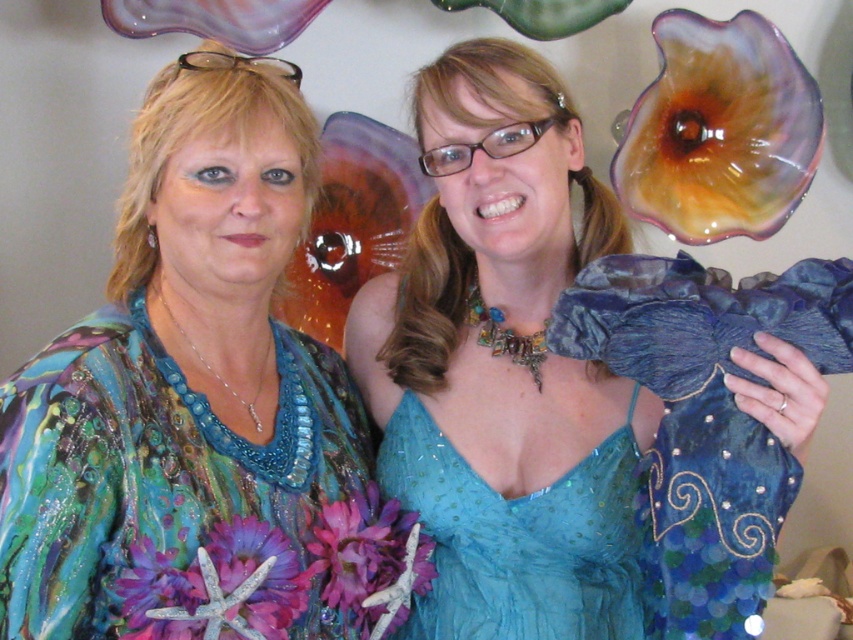
Question: Does blue sequined dress at center have a smaller size compared to teal sheer dress at center?

Choices:
 (A) no
 (B) yes

Answer: (A)

Question: Among these objects, which one is nearest to the camera?

Choices:
 (A) teal sheer dress at center
 (B) shiny blue dress at center

Answer: (B)

Question: Is blue sequined dress at center to the left of teal sheer dress at center from the viewer's perspective?

Choices:
 (A) yes
 (B) no

Answer: (B)

Question: Which point is closer to the camera taking this photo?

Choices:
 (A) (792, 412)
 (B) (534, 556)

Answer: (A)

Question: Does shiny blue dress at center appear over blue sequined dress at center?

Choices:
 (A) no
 (B) yes

Answer: (B)

Question: Which point is farther from the camera taking this photo?

Choices:
 (A) (236, 598)
 (B) (444, 540)
 (C) (526, 188)

Answer: (B)